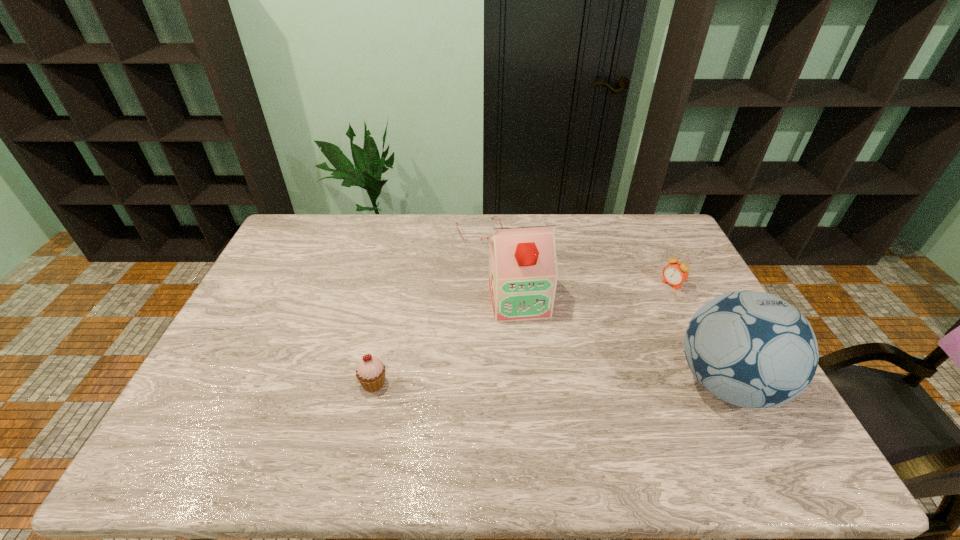
You are a GUI agent. You are given a task and a screenshot of the screen. Output one action in this format:
    pyautogui.click(x=<x>, y=<y>)
    Task: Click on the alarm clock positioned at the right edge
    This screenshot has width=960, height=540.
    Given the screenshot: What is the action you would take?
    pyautogui.click(x=675, y=273)

Where is `object that is at the near right corner`? Image resolution: width=960 pixels, height=540 pixels. object that is at the near right corner is located at coordinates [x=752, y=349].

Identify the location of vacant area at the far edge of the desktop. This screenshot has height=540, width=960. (564, 245).

Where is `vacant space at the near edge of the desktop`? The height and width of the screenshot is (540, 960). vacant space at the near edge of the desktop is located at coordinates (561, 413).

In the image, there is a desktop. In order to click on vacant region at the left edge in this screenshot , I will do `click(247, 353)`.

This screenshot has height=540, width=960. What are the coordinates of `free spot at the right edge of the desktop` in the screenshot? It's located at (684, 325).

Find the location of a particular element. The image size is (960, 540). free space at the near left corner of the desktop is located at coordinates (222, 424).

Where is `free spot between the leftmost object and the soccer ball`? free spot between the leftmost object and the soccer ball is located at coordinates (550, 383).

Where is `vacant region between the soccer ball and the spectacles`? This screenshot has width=960, height=540. vacant region between the soccer ball and the spectacles is located at coordinates tap(603, 308).

The width and height of the screenshot is (960, 540). I want to click on unoccupied position between the alarm clock and the soya milk, so click(x=595, y=292).